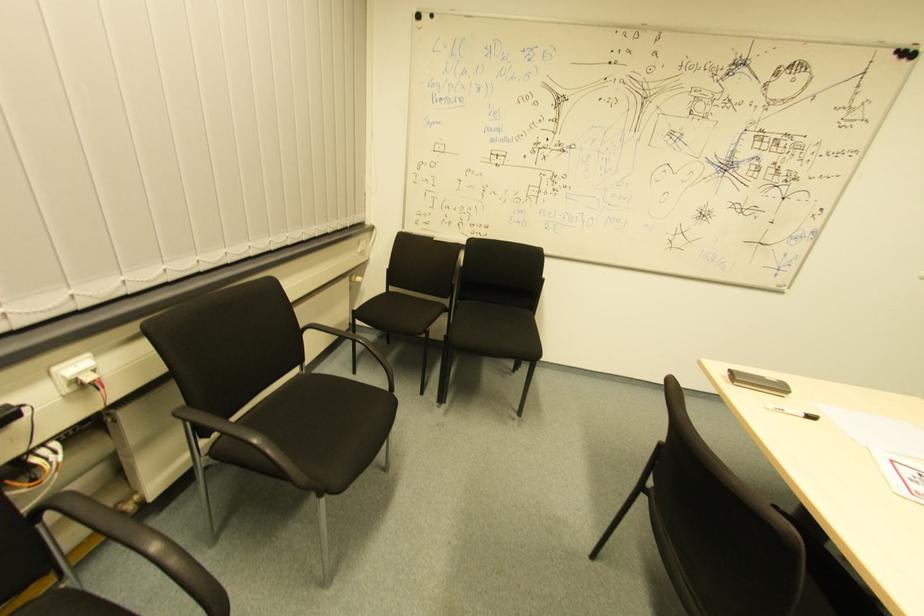
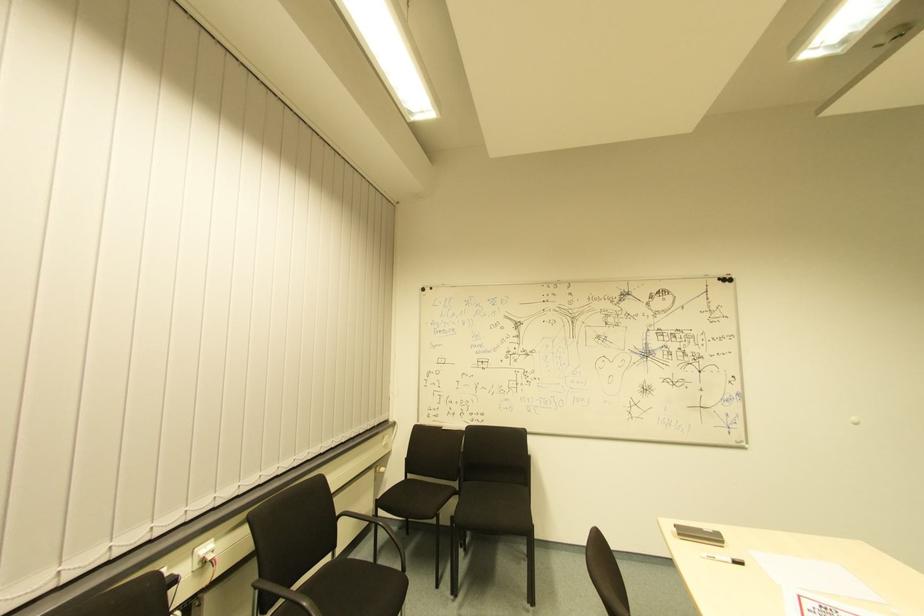
Where in the second image is the point corresponding to (x=810, y=421) from the first image?

(737, 565)